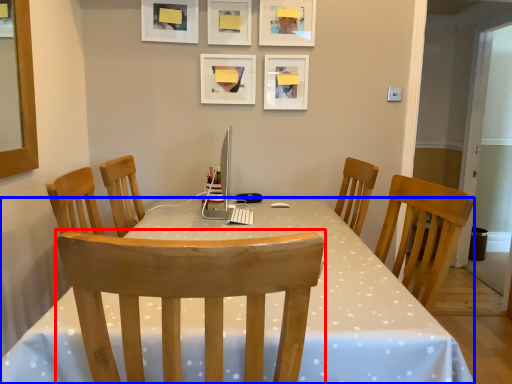
Question: Which object is closer to the camera taking this photo, chair (highlighted by a red box) or desk (highlighted by a blue box)?

Choices:
 (A) chair
 (B) desk

Answer: (A)